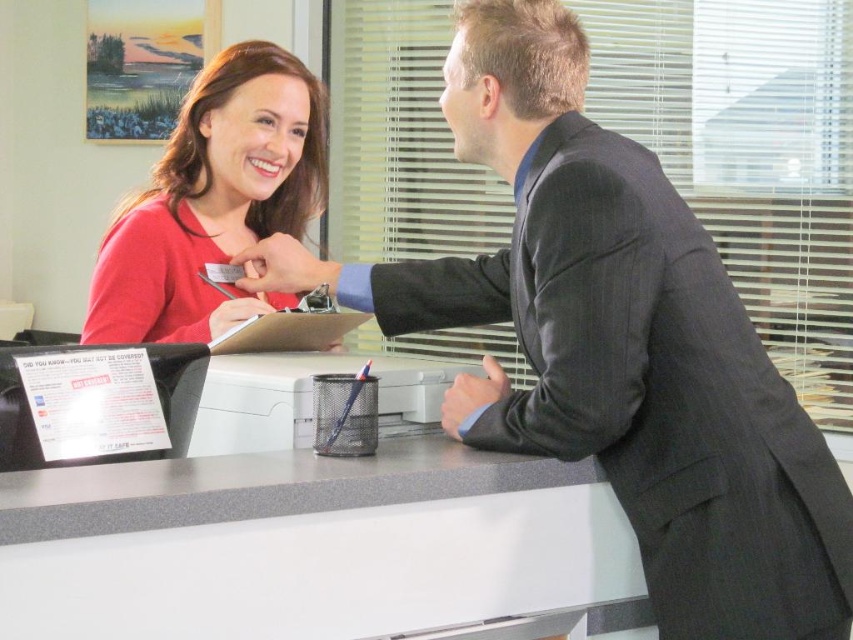
Is matte black tag at center positioned at the back of matte black pen at center?

Yes, it is behind matte black pen at center.

Does point (263, 248) lie behind point (254, 307)?

That is True.

Measure the distance between point (321,273) and camera.

Point (321,273) and camera are 5.17 feet apart from each other.

Locate an element on the screen. matte black tag at center is located at coordinates (282, 266).

Image resolution: width=853 pixels, height=640 pixels. What do you see at coordinates (212, 195) in the screenshot?
I see `matte red sweater at upper left` at bounding box center [212, 195].

Can you confirm if matte red sweater at upper left is positioned to the right of satin black suit at center?

No, matte red sweater at upper left is not to the right of satin black suit at center.

Who is more distant from viewer, (99, 337) or (476, 408)?

The point (99, 337) is behind.

Where is `matte red sweater at upper left`? Image resolution: width=853 pixels, height=640 pixels. matte red sweater at upper left is located at coordinates (212, 195).

Does satin black suit at center have a greater width compared to matte black pen at center?

In fact, satin black suit at center might be narrower than matte black pen at center.

Which of these two, satin black suit at center or matte black pen at center, stands shorter?

Standing shorter between the two is matte black pen at center.

This screenshot has height=640, width=853. Find the location of `satin black suit at center`. satin black suit at center is located at coordinates (471, 396).

At what (x,y) coordinates should I click in order to perform the action: click on satin black suit at center. Please return your answer as a coordinate pair (x, y). The height and width of the screenshot is (640, 853). Looking at the image, I should click on (471, 396).